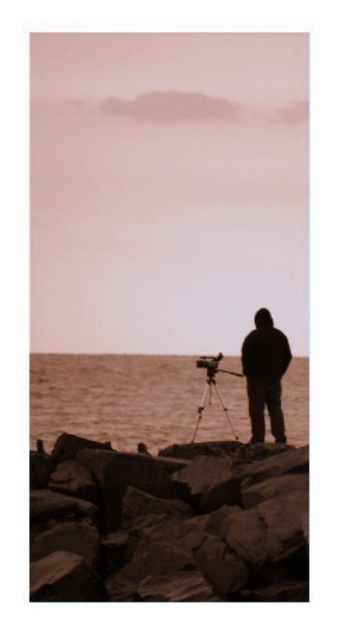
Is brown water at center thinner than matte black tripod at center?

No, brown water at center is not thinner than matte black tripod at center.

Who is more distant from viewer, (x=122, y=378) or (x=194, y=432)?

The point (x=122, y=378) is more distant.

I want to click on brown water at center, so click(113, 397).

Who is taller, brown water at center or black matte jacket at center?

brown water at center

Can you confirm if brown water at center is positioned below black matte jacket at center?

Yes, brown water at center is below black matte jacket at center.

Between point (93, 426) and point (260, 401), which one is positioned in front?

Point (260, 401) is more forward.

What are the coordinates of `brown water at center` in the screenshot? It's located at (113, 397).

Between rusty stone rocks at lower center and brown water at center, which one has less height?

rusty stone rocks at lower center

Can you confirm if rusty stone rocks at lower center is shorter than brown water at center?

Correct, rusty stone rocks at lower center is not as tall as brown water at center.

Identify the location of rusty stone rocks at lower center. (168, 522).